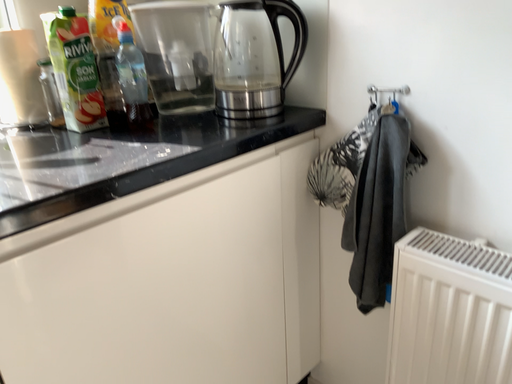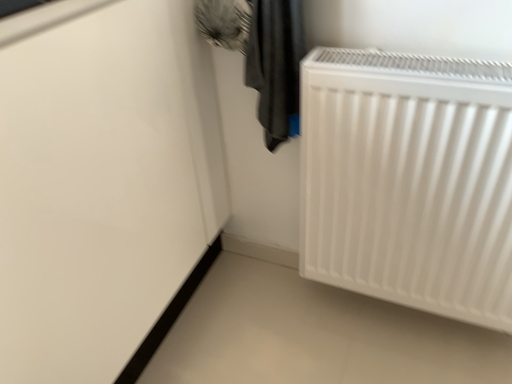
Question: How did the camera likely rotate when shooting the video?

Choices:
 (A) rotated upward
 (B) rotated downward

Answer: (B)